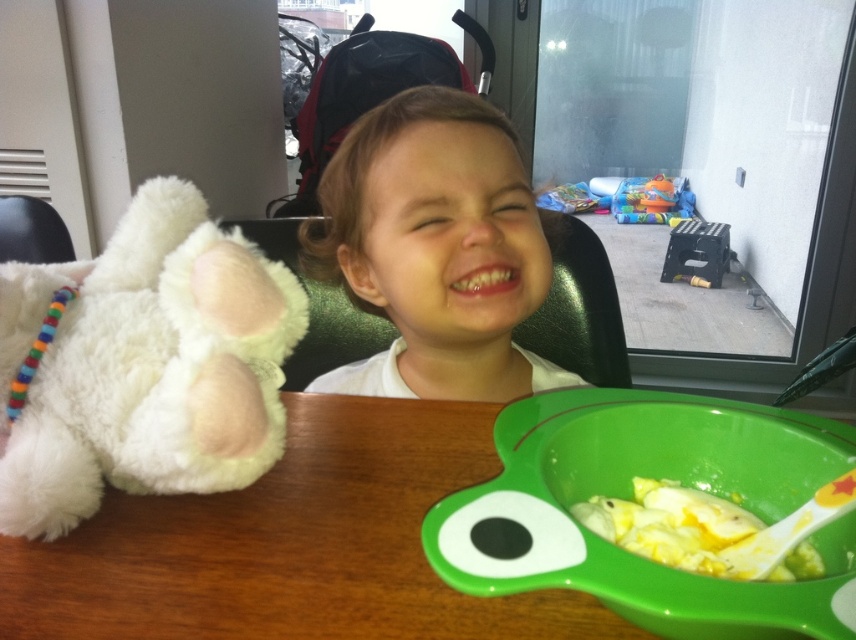
Is point (545, 550) behind point (684, 253)?

That is False.

Can you confirm if green plastic bowl at lower right is positioned to the left of black plastic folding stool at lower right?

Indeed, green plastic bowl at lower right is positioned on the left side of black plastic folding stool at lower right.

Which is in front, point (728, 612) or point (718, 227)?

Point (728, 612)

I want to click on green plastic bowl at lower right, so click(628, 497).

Is smooth skin child at center thinner than black plastic folding stool at lower right?

In fact, smooth skin child at center might be wider than black plastic folding stool at lower right.

Who is positioned more to the right, smooth skin child at center or black plastic folding stool at lower right?

Positioned to the right is black plastic folding stool at lower right.

Find the location of `smooth skin child at center`. smooth skin child at center is located at coordinates (434, 250).

Which is above, green plastic bowl at lower right or yellow soft food at lower center?

green plastic bowl at lower right

Is point (581, 458) positioned behind point (706, 544)?

That is True.

At what (x,y) coordinates should I click in order to perform the action: click on green plastic bowl at lower right. Please return your answer as a coordinate pair (x, y). Image resolution: width=856 pixels, height=640 pixels. Looking at the image, I should click on (628, 497).